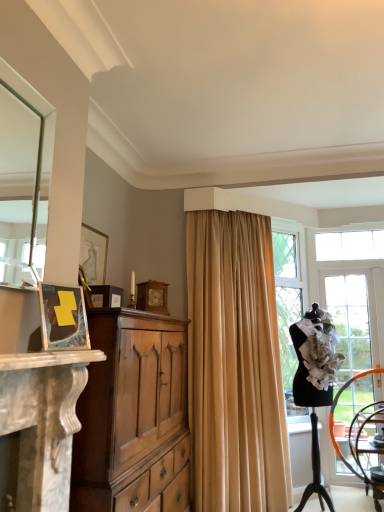
What do you see at coordinates (341, 295) in the screenshot?
I see `black mannequin at right` at bounding box center [341, 295].

What are the coordinates of `matte brown picture frame at center-left, which is the third picture frame in back-to-front order` in the screenshot? It's located at (104, 296).

Describe the element at coordinates (93, 255) in the screenshot. This screenshot has height=512, width=384. I see `matte gold picture frame at upper left, the second picture frame from the back` at that location.

Measure the distance between wooden clock at center, the 4th picture frame from the front, and camera.

wooden clock at center, the 4th picture frame from the front, is 2.96 meters from camera.

The image size is (384, 512). Identify the location of black mannequin at right. (341, 295).

How far apart are matte brown picture frame at center-left, the 2th picture frame from the front, and light brown wood cabinet at left?

matte brown picture frame at center-left, the 2th picture frame from the front, and light brown wood cabinet at left are 56.08 centimeters apart.

From a real-world perspective, between matte brown picture frame at center-left, which is the third picture frame in back-to-front order, and light brown wood cabinet at left, who is vertically lower?

light brown wood cabinet at left.

Is matte brown picture frame at center-left, which is the third picture frame in back-to-front order, not near light brown wood cabinet at left?

No, matte brown picture frame at center-left, which is the third picture frame in back-to-front order, is not far away from light brown wood cabinet at left.

In terms of height, does matte brown picture frame at center-left, the 2th picture frame from the front, look taller or shorter compared to light brown wood cabinet at left?

Considering their sizes, matte brown picture frame at center-left, the 2th picture frame from the front, has less height than light brown wood cabinet at left.

Where is `the 3rd picture frame in front of the black mannequin at right`? the 3rd picture frame in front of the black mannequin at right is located at coordinates (63, 317).

From a real-world perspective, which is physically above, black mannequin at right or matte black picture frame at left, the first picture frame when ordered from front to back?

matte black picture frame at left, the first picture frame when ordered from front to back, is physically above.

Between black mannequin at right and matte black picture frame at left, the first picture frame when ordered from front to back, which one has smaller size?

With smaller size is matte black picture frame at left, the first picture frame when ordered from front to back.

Can clear glass door at right be found inside wooden clock at center, the 4th picture frame from the front?

Actually, clear glass door at right is outside wooden clock at center, the 4th picture frame from the front.

Is wooden clock at center, the 4th picture frame from the front, bigger than clear glass door at right?

Incorrect, wooden clock at center, the 4th picture frame from the front, is not larger than clear glass door at right.

Is wooden clock at center, positioned as the first picture frame in back-to-front order, closer to the viewer compared to clear glass door at right?

Yes, it is.

From a real-world perspective, between wooden clock at center, positioned as the first picture frame in back-to-front order, and clear glass door at right, who is vertically higher?

wooden clock at center, positioned as the first picture frame in back-to-front order.

Can you confirm if wooden clock at center, positioned as the first picture frame in back-to-front order, is positioned to the left of beige fabric curtain at center?

Correct, you'll find wooden clock at center, positioned as the first picture frame in back-to-front order, to the left of beige fabric curtain at center.

From the image's perspective, does wooden clock at center, the 4th picture frame from the front, appear higher than beige fabric curtain at center?

Indeed, from the image's perspective, wooden clock at center, the 4th picture frame from the front, is shown above beige fabric curtain at center.

Is wooden clock at center, the 4th picture frame from the front, spatially inside beige fabric curtain at center, or outside of it?

wooden clock at center, the 4th picture frame from the front, is not inside beige fabric curtain at center, it's outside.

Is wooden clock at center, positioned as the first picture frame in back-to-front order, aimed at beige fabric curtain at center?

No, wooden clock at center, positioned as the first picture frame in back-to-front order, is not aimed at beige fabric curtain at center.

Could you measure the distance between matte black picture frame at left, the first picture frame when ordered from front to back, and light brown wood cabinet at left?

matte black picture frame at left, the first picture frame when ordered from front to back, is 28.16 inches from light brown wood cabinet at left.

From the image's perspective, which is below, matte black picture frame at left, the 4th picture frame from the back, or light brown wood cabinet at left?

light brown wood cabinet at left is shown below in the image.

Is matte black picture frame at left, the 4th picture frame from the back, facing away from light brown wood cabinet at left?

No, light brown wood cabinet at left is not at the back of matte black picture frame at left, the 4th picture frame from the back.

From a real-world perspective, between matte black picture frame at left, the first picture frame when ordered from front to back, and light brown wood cabinet at left, who is vertically higher?

matte black picture frame at left, the first picture frame when ordered from front to back.

Does black mannequin at right have a lesser height compared to wooden chair at lower right?

Incorrect, the height of black mannequin at right does not fall short of that of wooden chair at lower right.

Which object is more forward, black mannequin at right or wooden chair at lower right?

black mannequin at right.

How many degrees apart are the facing directions of black mannequin at right and wooden chair at lower right?

56.9 degrees.

Which object is positioned more to the right, black mannequin at right or wooden chair at lower right?

Positioned to the right is wooden chair at lower right.

Does matte gold picture frame at upper left, arranged as the 3th picture frame when viewed from the front, have a greater width compared to wooden clock at center, positioned as the first picture frame in back-to-front order?

No.

Which is more to the right, matte gold picture frame at upper left, the second picture frame from the back, or wooden clock at center, positioned as the first picture frame in back-to-front order?

wooden clock at center, positioned as the first picture frame in back-to-front order, is more to the right.

In the scene shown: From a real-world perspective, relative to wooden clock at center, the 4th picture frame from the front, is matte gold picture frame at upper left, the second picture frame from the back, vertically above or below?

matte gold picture frame at upper left, the second picture frame from the back, is situated higher than wooden clock at center, the 4th picture frame from the front, in the real world.

Image resolution: width=384 pixels, height=512 pixels. What are the coordinates of `cabinetry below the matte brown picture frame at center-left, which is the third picture frame in back-to-front order (from a real-world perspective)` in the screenshot? It's located at pyautogui.click(x=130, y=410).

Find the location of a particular element. The image size is (384, 512). picture frame that is the 3rd object located in front of the black mannequin at right is located at coordinates (63, 317).

Which object lies nearer to the anchor point wooden chair at lower right, light brown wood cabinet at left or black mannequin at right?

black mannequin at right is closer to wooden chair at lower right.

When comparing their distances from matte brown picture frame at center-left, which is the third picture frame in back-to-front order, does black mannequin at right or matte gold picture frame at upper left, arranged as the 3th picture frame when viewed from the front, seem further?

Among the two, black mannequin at right is located further to matte brown picture frame at center-left, which is the third picture frame in back-to-front order.

Which object lies further to the anchor point black mannequin at right, clear glass door at right or wooden chair at lower right?

The object further to black mannequin at right is wooden chair at lower right.

In the scene shown: Which object lies nearer to the anchor point wooden clock at center, positioned as the first picture frame in back-to-front order, clear glass door at right or matte brown picture frame at center-left, which is the third picture frame in back-to-front order?

Among the two, matte brown picture frame at center-left, which is the third picture frame in back-to-front order, is located nearer to wooden clock at center, positioned as the first picture frame in back-to-front order.

From the image, which object appears to be nearer to matte brown picture frame at center-left, which is the third picture frame in back-to-front order, light brown wood cabinet at left or black mannequin at right?

light brown wood cabinet at left is closer to matte brown picture frame at center-left, which is the third picture frame in back-to-front order.

When comparing their distances from wooden chair at lower right, does light brown wood cabinet at left or matte brown picture frame at center-left, which is the third picture frame in back-to-front order, seem closer?

The object closer to wooden chair at lower right is light brown wood cabinet at left.

Consider the image. Estimate the real-world distances between objects in this image. Which object is closer to beige fabric curtain at center, matte gold picture frame at upper left, arranged as the 3th picture frame when viewed from the front, or matte black picture frame at left, the first picture frame when ordered from front to back?

matte gold picture frame at upper left, arranged as the 3th picture frame when viewed from the front, is positioned closer to the anchor beige fabric curtain at center.

Estimate the real-world distances between objects in this image. Which object is further from matte black picture frame at left, the first picture frame when ordered from front to back, wooden clock at center, positioned as the first picture frame in back-to-front order, or light brown wood cabinet at left?

wooden clock at center, positioned as the first picture frame in back-to-front order, is further to matte black picture frame at left, the first picture frame when ordered from front to back.

Identify the location of window between matte black picture frame at left, the 4th picture frame from the back, and clear glass door at right from front to back. (341, 295).

Where is `curtain between matte black picture frame at left, the first picture frame when ordered from front to back, and wooden clock at center, positioned as the first picture frame in back-to-front order, along the z-axis`? curtain between matte black picture frame at left, the first picture frame when ordered from front to back, and wooden clock at center, positioned as the first picture frame in back-to-front order, along the z-axis is located at coordinates (234, 365).

This screenshot has width=384, height=512. I want to click on cabinetry between matte gold picture frame at upper left, the second picture frame from the back, and black mannequin at right, in the horizontal direction, so point(130,410).

Identify the location of picture frame between matte brown picture frame at center-left, which is the third picture frame in back-to-front order, and wooden clock at center, the 4th picture frame from the front, from front to back. (93, 255).